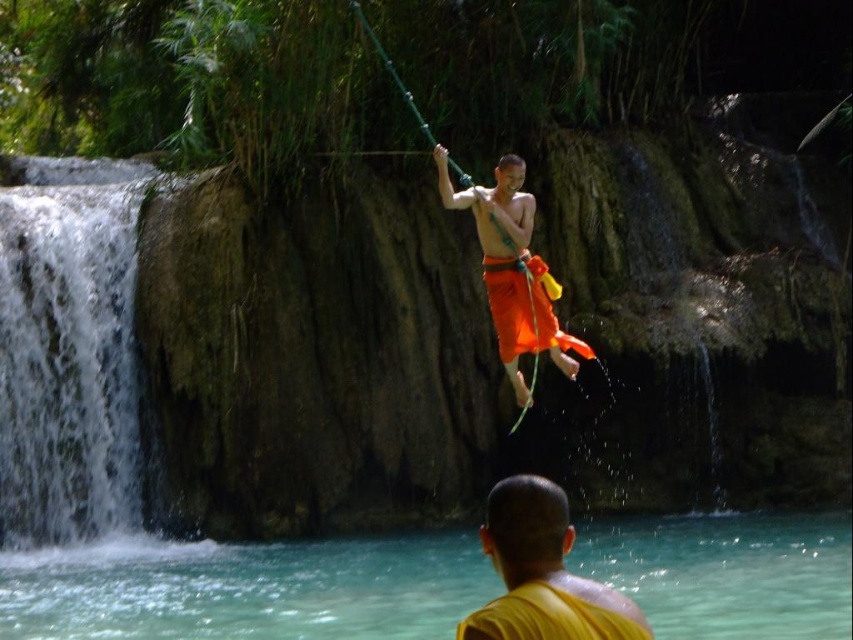
You are standing at the base of the waterfall and see the yellow matte monk at lower center and the orange fabric at center. Which object is nearer to you?

The yellow matte monk at lower center is closer to the viewer than the orange fabric at center, so the yellow matte monk at lower center is nearer to you.